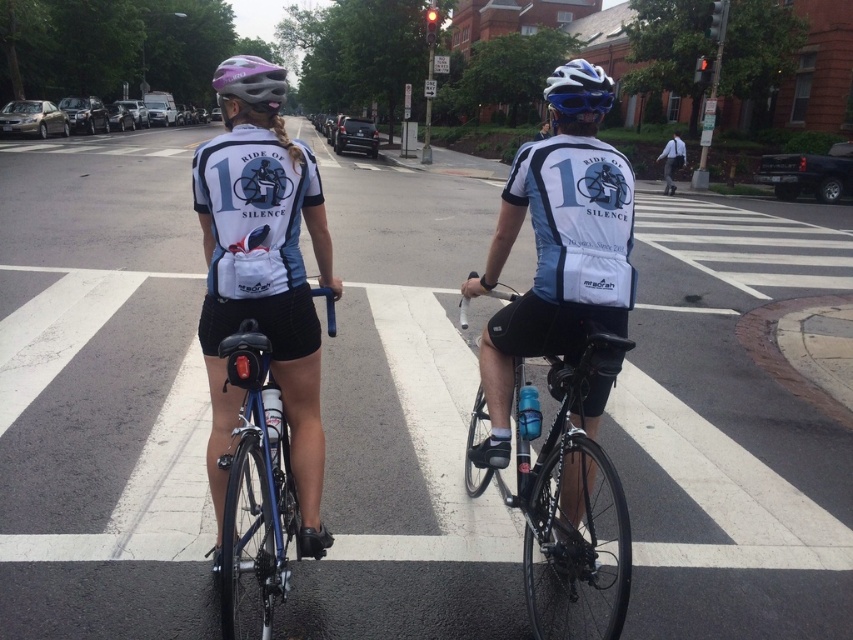
You are a photographer trying to capture a clear shot of both the shiny black frame at center and the matte blue helmet at upper center in the image. Since you want to ensure both are visible, which object should you focus on first considering their sizes?

The shiny black frame at center occupies less space than the matte blue helmet at upper center, so you should focus on the shiny black frame at center first to ensure its smaller size is captured clearly.

You are a delivery drone operator who needs to deliver a package to a cyclist at the pedestrian crossing. The package must be placed exactly between the blue metallic bicycle at center and the purple matte bicycle helmet at upper center. What is the minimum distance the drone needs to fly to reach the midpoint?

The distance between the blue metallic bicycle at center and the purple matte bicycle helmet at upper center is 1.47 meters. To find the midpoint, divide this distance by 2, resulting in 0.735 meters. Therefore, the drone must fly a minimum of 0.735 meters from either object to reach the midpoint.